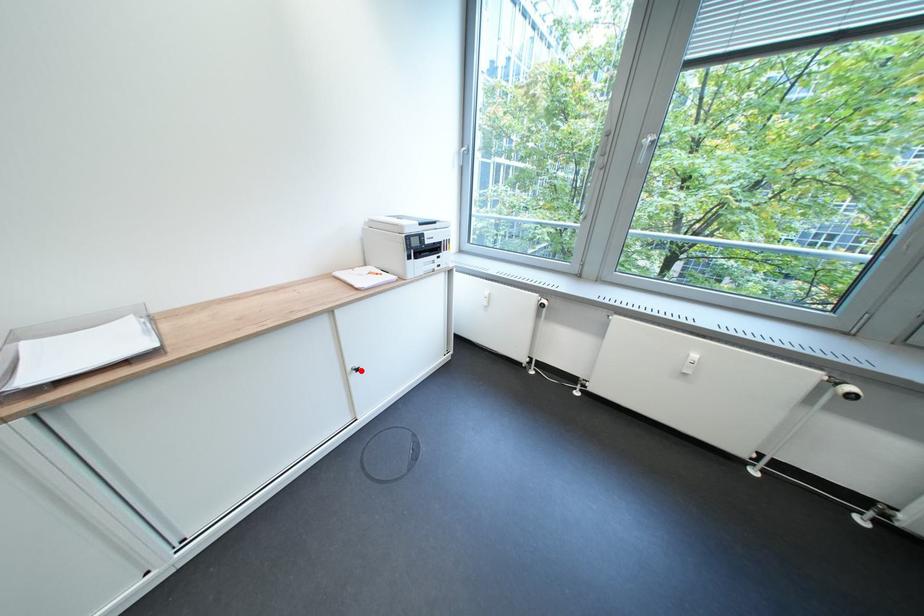
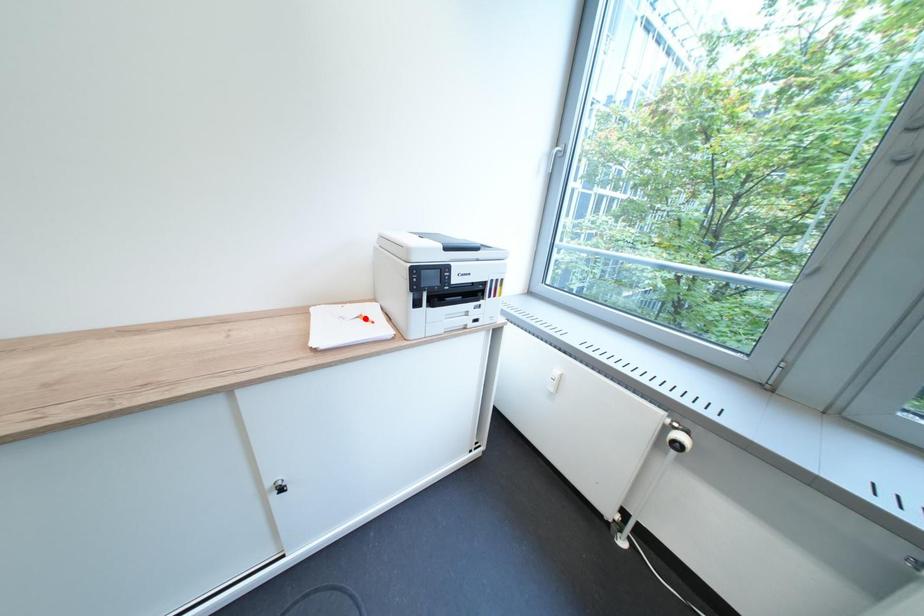
I am providing you with two images of the same scene from different viewpoints. A red point is marked on the first image and another point is marked on the second image. Is the red point in image1 aligned with the point shown in image2?

No